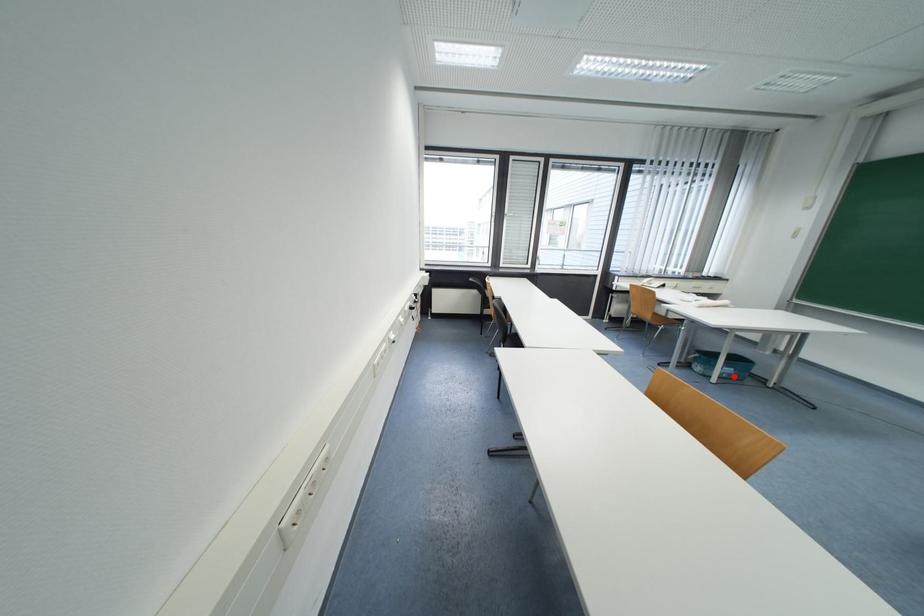
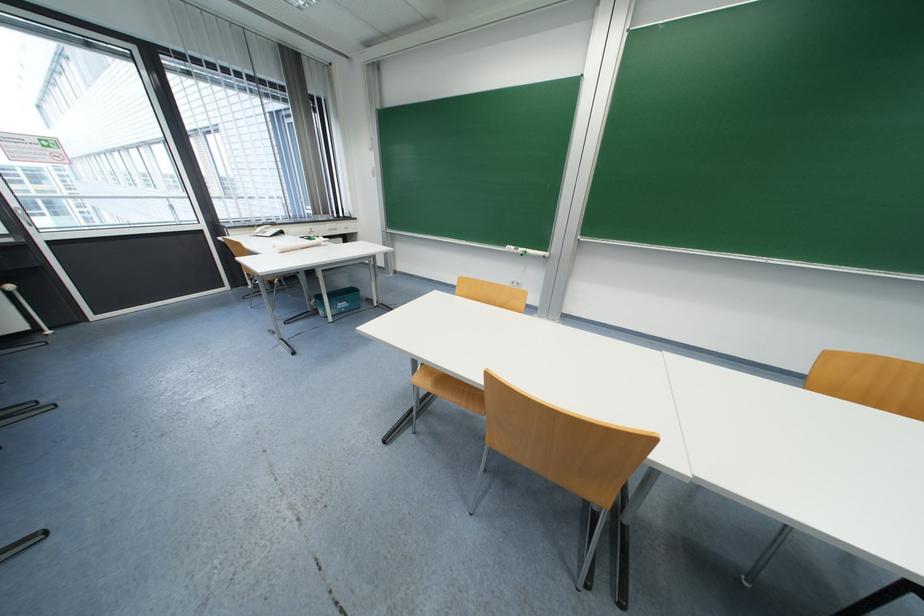
Question: I am providing you with two images of the same scene from different viewpoints. A red point is shown in image1. For the corresponding object point in image2, is it positioned nearer or farther from the camera?

Choices:
 (A) Nearer
 (B) Farther

Answer: (A)